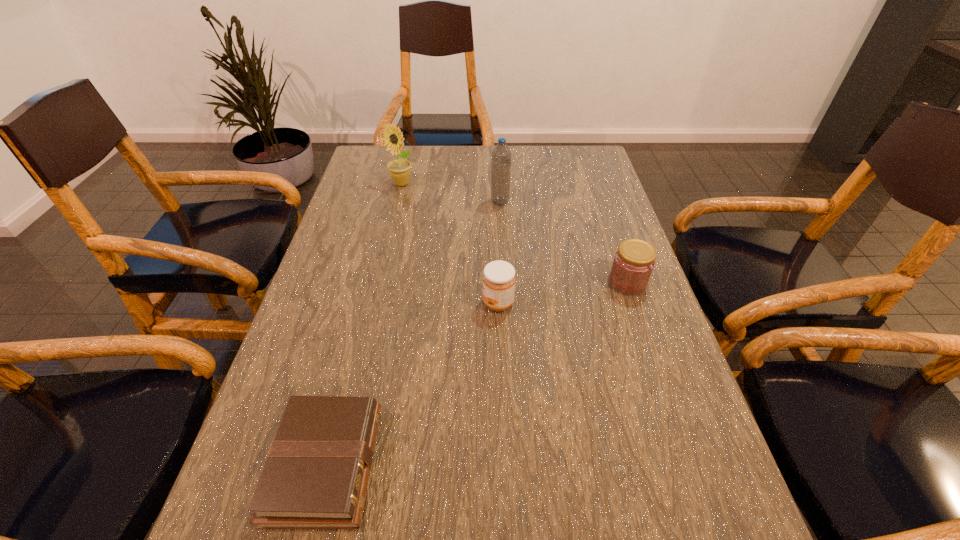
The width and height of the screenshot is (960, 540). I want to click on free space between the rightmost object and the water bottle, so click(x=564, y=242).

Where is `free spot between the left jam and the shortest object`? This screenshot has width=960, height=540. free spot between the left jam and the shortest object is located at coordinates (412, 383).

Locate an element on the screen. Image resolution: width=960 pixels, height=540 pixels. the third closest object to the rightmost object is located at coordinates (316, 474).

Find the location of `object that is the third nearest to the rightmost object`. object that is the third nearest to the rightmost object is located at coordinates (316, 474).

Locate an element on the screen. This screenshot has width=960, height=540. vacant position in the image that satisfies the following two spatial constraints: 1. on the front side of the right jam; 2. on the spine side of the nearest object is located at coordinates (689, 463).

This screenshot has height=540, width=960. I want to click on vacant area that satisfies the following two spatial constraints: 1. on the face of the farthest object; 2. on the spine side of the nearest object, so click(335, 463).

Locate an element on the screen. free point that satisfies the following two spatial constraints: 1. on the front side of the rightmost object; 2. on the spine side of the shortest object is located at coordinates (689, 463).